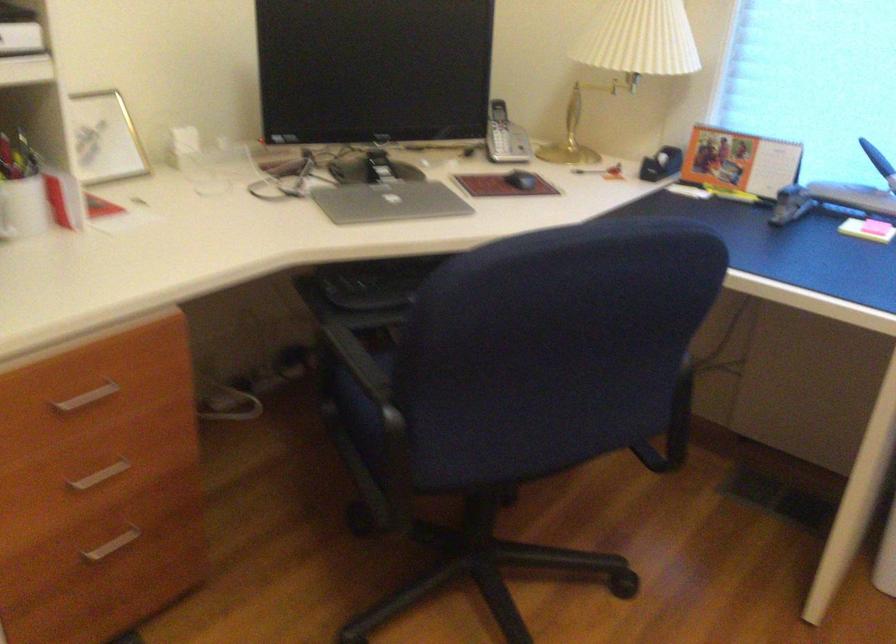
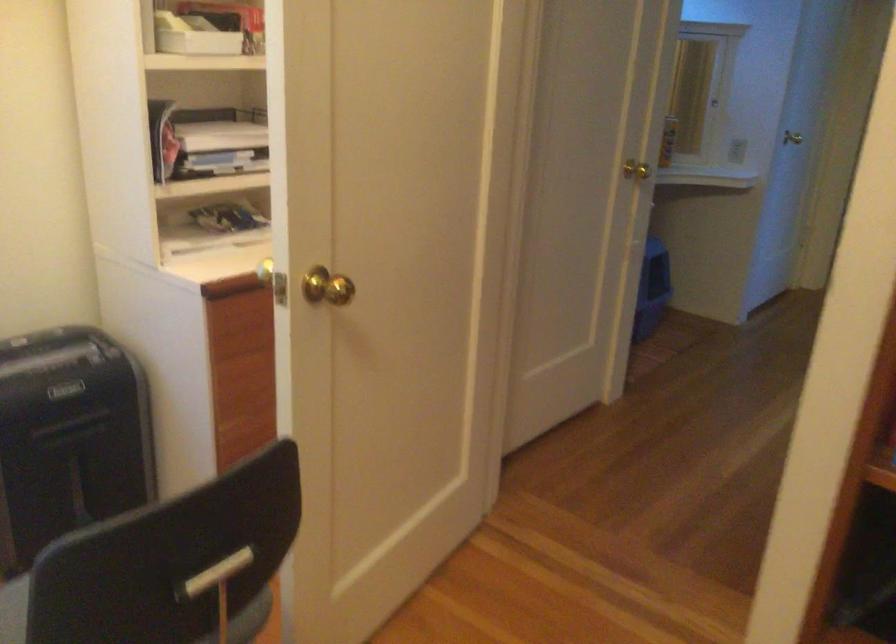
From the picture: The images are taken continuously from a first-person perspective. In which direction is your viewpoint rotating?

The camera's rotation is toward right-down.